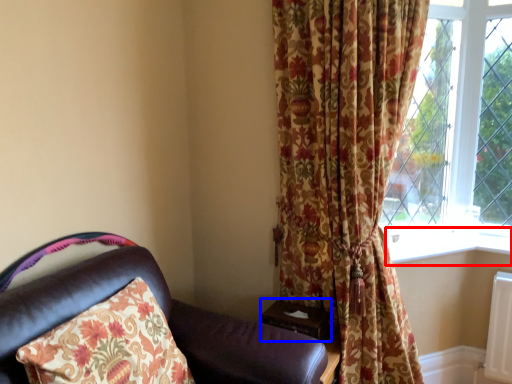
Question: Which point is closer to the camera, window sill (highlighted by a red box) or table (highlighted by a blue box)?

Choices:
 (A) window sill
 (B) table

Answer: (B)